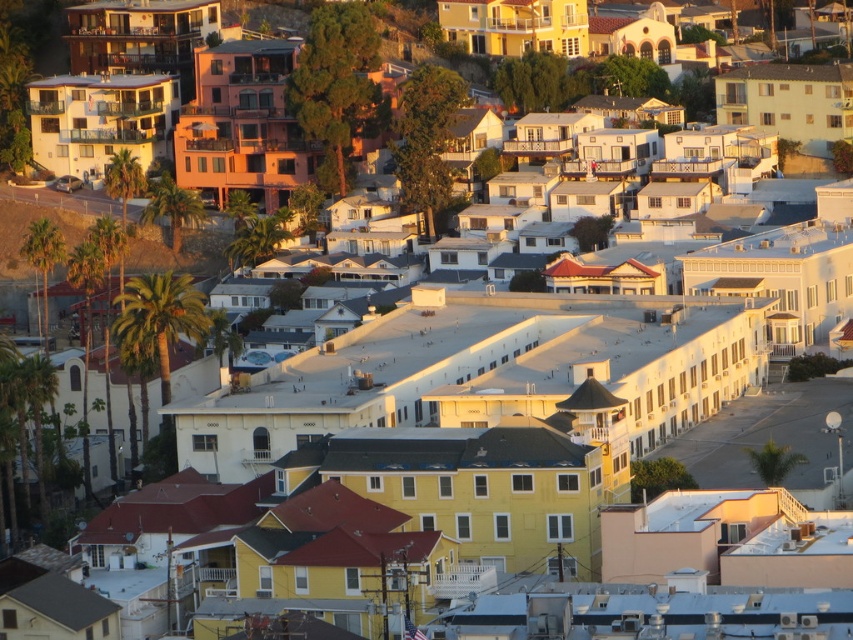
Which is behind, point (195, 337) or point (167, 186)?

Positioned behind is point (167, 186).

Is point (120, 298) closer to camera compared to point (196, 198)?

Yes.

The image size is (853, 640). I want to click on green leafy palm tree at lower left, so click(x=160, y=320).

Describe the element at coordinates (180, 250) in the screenshot. I see `green leafy palm trees at left` at that location.

Can you confirm if green leafy palm trees at left is positioned below green leafy palm tree at left?

Incorrect, green leafy palm trees at left is not positioned below green leafy palm tree at left.

Does point (207, 266) come in front of point (57, 241)?

No, (207, 266) is further to viewer.

The width and height of the screenshot is (853, 640). What are the coordinates of `green leafy palm trees at left` in the screenshot? It's located at (180, 250).

Is green leafy palm tree at left shorter than green leafy palm tree at center-left?

No.

Is green leafy palm tree at left above green leafy palm tree at center-left?

No.

Locate an element on the screen. The height and width of the screenshot is (640, 853). green leafy palm tree at left is located at coordinates (44, 262).